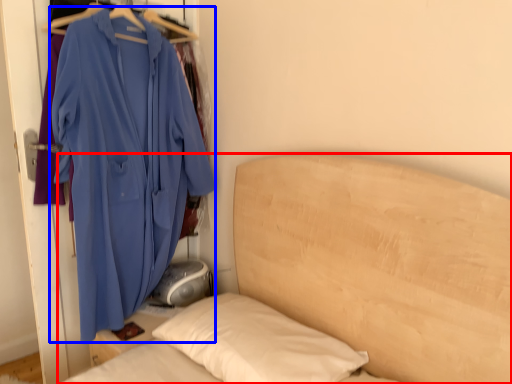
Question: Among these objects, which one is nearest to the camera, bed (highlighted by a red box) or jacket (highlighted by a blue box)?

Choices:
 (A) bed
 (B) jacket

Answer: (A)